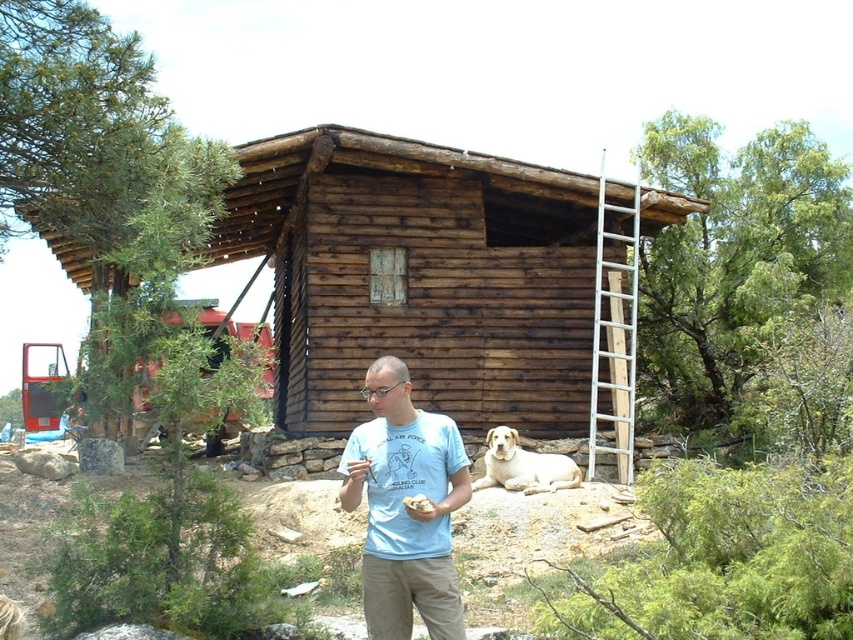
You are standing at the camera position and want to reach the point at coordinates (614, 330). If you walk straight towards it, how far will you have to walk?

The point at coordinates (614, 330) is 68.48 feet away from the camera, so you will have to walk 68.48 feet straight towards it to reach it.

You are a delivery drone that needs to land near the cabin. You must avoid the silver metallic ladder at right and the light yellow fur at lower center. What is the minimum distance you should maintain from both objects to ensure safe landing?

The minimum distance you should maintain from both the silver metallic ladder at right and the light yellow fur at lower center is 3.71 meters, which is the distance between them. This ensures the drone stays clear of both objects.